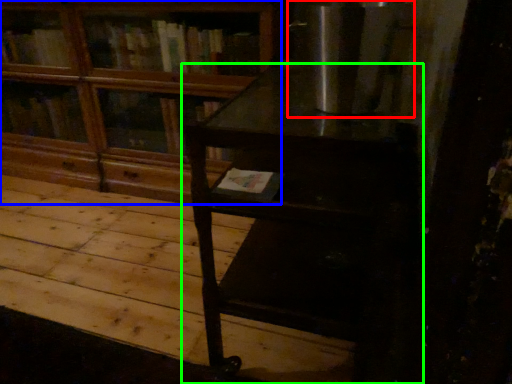
Question: Which object is the closest to the appliance (highlighted by a red box)? Choose among these: bookcase (highlighted by a blue box) or table (highlighted by a green box).

Choices:
 (A) bookcase
 (B) table

Answer: (B)